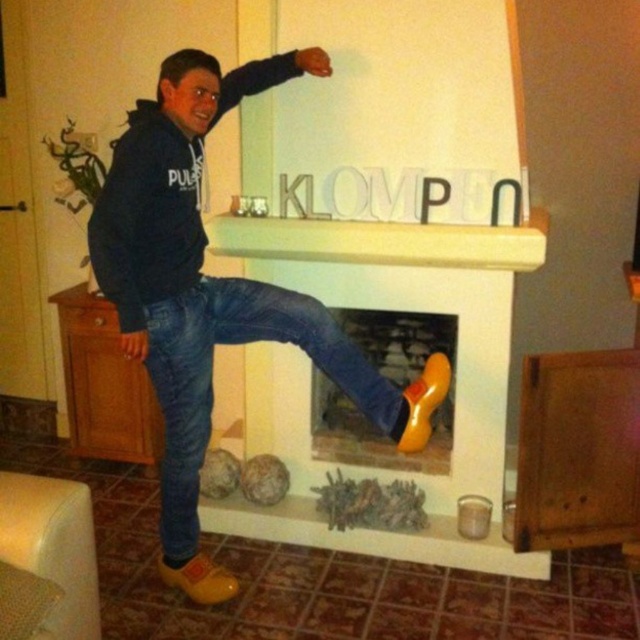
You are trying to place a decorative item on the mantel above the fireplace. The mantel is 0.5 meters wide. The yellow leather clogs at center are located at point [212,294]. Will the yellow leather clogs at center fit on the mantel?

The yellow leather clogs at center are located at point [212,294], which is within the 0.5 meters width of the mantel. Therefore, the yellow leather clogs at center will fit on the mantel.

You are a photographer trying to capture the yellow leather clogs at center in a closeup shot. Considering the distance between the clogs and the camera, can you get a clear, detailed image without moving the camera or the clogs?

The yellow leather clogs at center is 6.53 feet away from the camera. A distance of 6.53 feet is sufficient for a clear, detailed closeup shot if the camera has a zoom lens or optical zoom capability. However, if the camera relies on digital zoom, the image quality may degrade slightly. Assuming standard photography conditions, the photographer can likely achieve a clear closeup without needing to move either the camera or the clogs.

You are designing a display stand for the yellow leather clogs at center and jeans at center. Which object requires a larger space on the stand?

The yellow leather clogs at center requires a larger space on the stand because it has a larger size compared to the jeans at center.